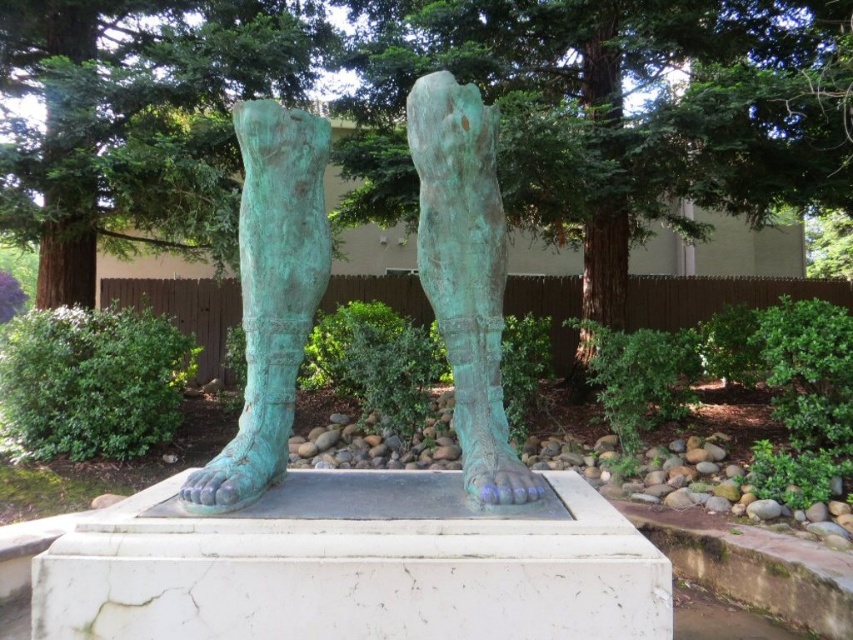
Is point (289, 179) farther from camera compared to point (247, 486)?

Yes, it is.

Measure the distance between point (428, 227) and camera.

The distance of point (428, 227) from camera is 2.22 meters.

This screenshot has width=853, height=640. Describe the element at coordinates (270, 294) in the screenshot. I see `green patina bronze feet at center` at that location.

You are a GUI agent. You are given a task and a screenshot of the screen. Output one action in this format:
    pyautogui.click(x=<x>, y=<y>)
    Task: Click on the green patina bronze feet at center
    The image size is (853, 640).
    Given the screenshot: What is the action you would take?
    pyautogui.click(x=270, y=294)

Can you confirm if green patina leg at center is positioned to the left of green patina foot at center?

Correct, you'll find green patina leg at center to the left of green patina foot at center.

Measure the distance from green patina leg at center to green patina foot at center.

They are 21.81 inches apart.

Does point (236, 440) lie behind point (492, 257)?

That is False.

Locate an element on the screen. The width and height of the screenshot is (853, 640). green patina leg at center is located at coordinates (270, 294).

Can you confirm if green patina bronze feet at center is smaller than green patina foot at center?

Yes.

Which is behind, point (262, 400) or point (485, 204)?

The point (485, 204) is behind.

Where is `green patina bronze feet at center`? This screenshot has height=640, width=853. green patina bronze feet at center is located at coordinates (270, 294).

This screenshot has height=640, width=853. I want to click on green patina bronze feet at center, so click(x=270, y=294).